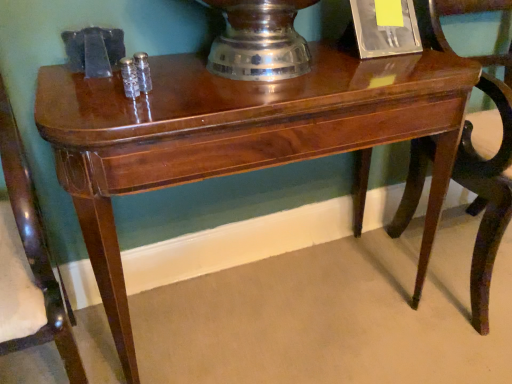
Question: Can you confirm if mahogany wood chair at left, the first chair from the left, is shorter than mahogany wood chair at right, acting as the first chair starting from the right?

Choices:
 (A) yes
 (B) no

Answer: (B)

Question: Can you confirm if mahogany wood chair at left, the first chair from the left, is bigger than mahogany wood chair at right, acting as the first chair starting from the right?

Choices:
 (A) no
 (B) yes

Answer: (A)

Question: Can you confirm if mahogany wood chair at left, which is the 2th chair from right to left, is wider than mahogany wood chair at right, arranged as the 2th chair when viewed from the left?

Choices:
 (A) yes
 (B) no

Answer: (B)

Question: From a real-world perspective, is mahogany wood chair at left, which is the 2th chair from right to left, on mahogany wood chair at right, acting as the first chair starting from the right?

Choices:
 (A) yes
 (B) no

Answer: (A)

Question: Can mahogany wood chair at right, acting as the first chair starting from the right, be found inside mahogany wood chair at left, which is the 2th chair from right to left?

Choices:
 (A) yes
 (B) no

Answer: (B)

Question: Is mahogany wood chair at left, the first chair from the left, far away from mahogany wood chair at right, arranged as the 2th chair when viewed from the left?

Choices:
 (A) yes
 (B) no

Answer: (A)

Question: Is mahogany wood chair at right, acting as the first chair starting from the right, turned away from mahogany wood chair at left, the first chair from the left?

Choices:
 (A) no
 (B) yes

Answer: (A)

Question: From the image's perspective, does mahogany wood chair at right, arranged as the 2th chair when viewed from the left, appear higher than mahogany wood chair at left, which is the 2th chair from right to left?

Choices:
 (A) no
 (B) yes

Answer: (B)

Question: Does mahogany wood chair at right, arranged as the 2th chair when viewed from the left, have a lesser width compared to mahogany wood chair at left, which is the 2th chair from right to left?

Choices:
 (A) yes
 (B) no

Answer: (B)

Question: From a real-world perspective, is mahogany wood chair at right, arranged as the 2th chair when viewed from the left, located beneath mahogany wood chair at left, the first chair from the left?

Choices:
 (A) yes
 (B) no

Answer: (A)

Question: Is mahogany wood chair at right, arranged as the 2th chair when viewed from the left, aimed at mahogany wood chair at left, the first chair from the left?

Choices:
 (A) yes
 (B) no

Answer: (B)

Question: Is mahogany wood chair at left, which is the 2th chair from right to left, a part of mahogany wood chair at right, acting as the first chair starting from the right?

Choices:
 (A) yes
 (B) no

Answer: (B)

Question: Is mahogany wood chair at left, which is the 2th chair from right to left, taller or shorter than mahogany wood chair at right, arranged as the 2th chair when viewed from the left?

Choices:
 (A) short
 (B) tall

Answer: (B)